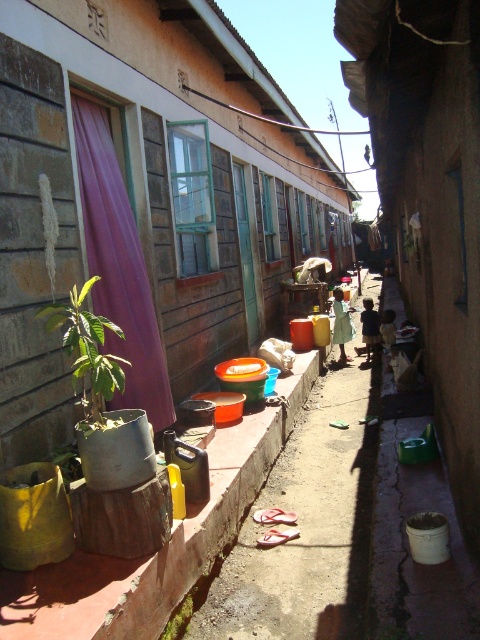
You are a window cleaner with a 1.5 meter ladder. You need to reach the purple fabric curtain at left and the green matte plant at left to clean their surfaces. Which object requires a longer ladder to reach?

The green matte plant at left requires a longer ladder because its width is greater than the purple fabric curtain at left, meaning it is taller and needs more reach.